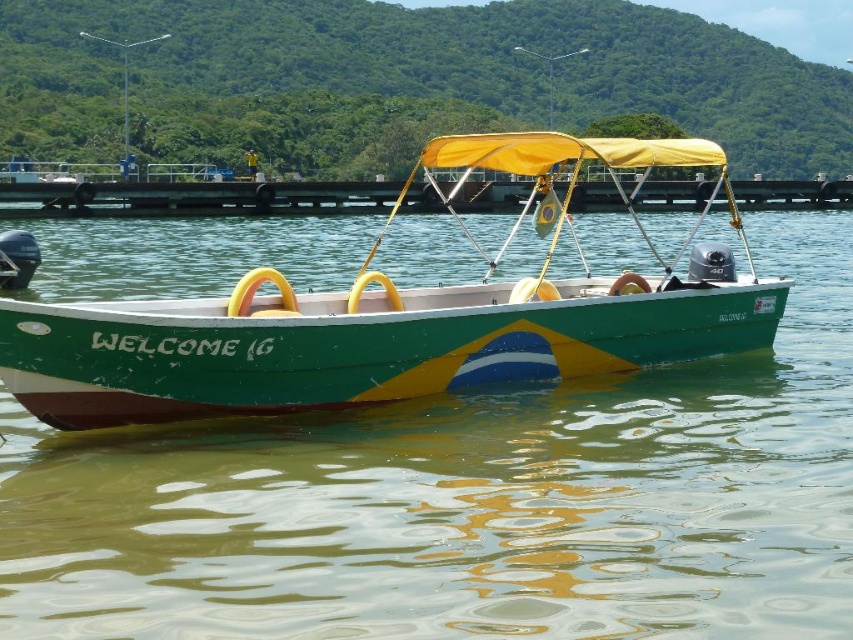
Is green matte boat at center taller than smooth concrete dock at center?

Indeed, green matte boat at center has a greater height compared to smooth concrete dock at center.

Between green matte boat at center and smooth concrete dock at center, which one appears on the right side from the viewer's perspective?

green matte boat at center is more to the right.

This screenshot has height=640, width=853. I want to click on green matte boat at center, so click(398, 314).

Locate an element on the screen. This screenshot has width=853, height=640. green matte boat at center is located at coordinates (398, 314).

Which is below, green glossy water at center or green matte boat at center?

green glossy water at center is below.

Does green glossy water at center appear on the left side of green matte boat at center?

Indeed, green glossy water at center is positioned on the left side of green matte boat at center.

Describe the element at coordinates (469, 500) in the screenshot. I see `green glossy water at center` at that location.

Identify the location of green glossy water at center. (469, 500).

Can you confirm if green glossy water at center is positioned to the right of smooth concrete dock at center?

Yes, green glossy water at center is to the right of smooth concrete dock at center.

Does green glossy water at center lie in front of smooth concrete dock at center?

Yes, it is in front of smooth concrete dock at center.

The height and width of the screenshot is (640, 853). What do you see at coordinates (469, 500) in the screenshot?
I see `green glossy water at center` at bounding box center [469, 500].

Where is `green glossy water at center`? green glossy water at center is located at coordinates (469, 500).